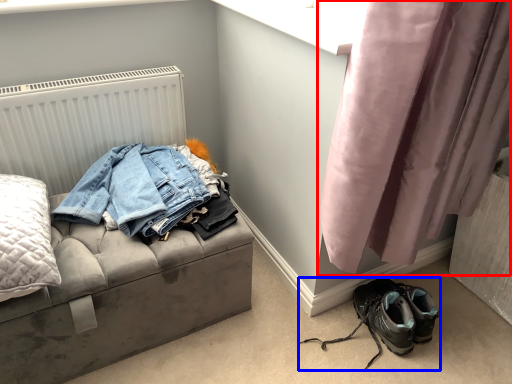
Question: Which point is further to the camera, curtain (highlighted by a red box) or footwear (highlighted by a blue box)?

Choices:
 (A) curtain
 (B) footwear

Answer: (B)